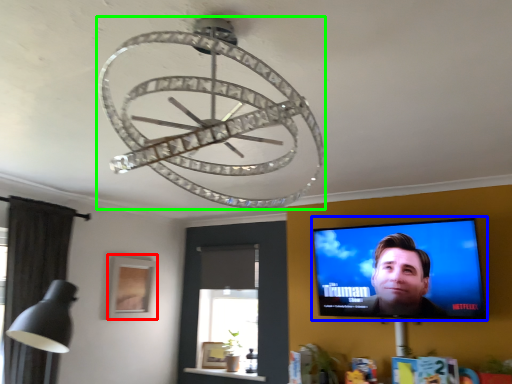
Question: Which object is the closest to the picture frame (highlighted by a red box)? Choose among these: computer screen (highlighted by a blue box) or lamp (highlighted by a green box).

Choices:
 (A) computer screen
 (B) lamp

Answer: (A)